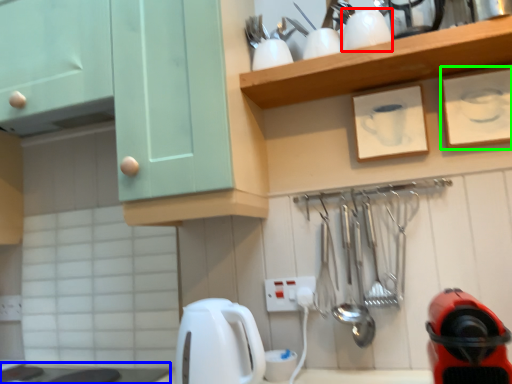
Question: Estimate the real-world distances between objects in this image. Which object is closer to appliance (highlighted by a red box), counter top (highlighted by a blue box) or picture frame (highlighted by a green box)?

Choices:
 (A) counter top
 (B) picture frame

Answer: (B)